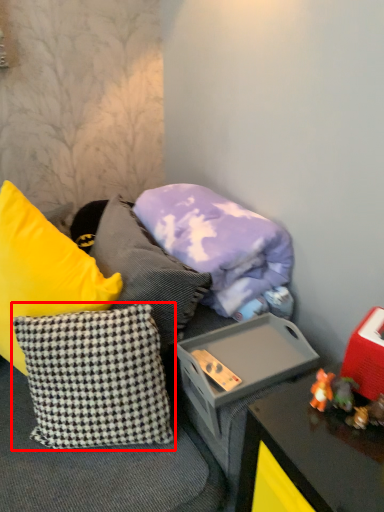
Question: From the image's perspective, what is the correct spatial positioning of pillow (annotated by the red box) in reference to pillow?

Choices:
 (A) below
 (B) above

Answer: (A)